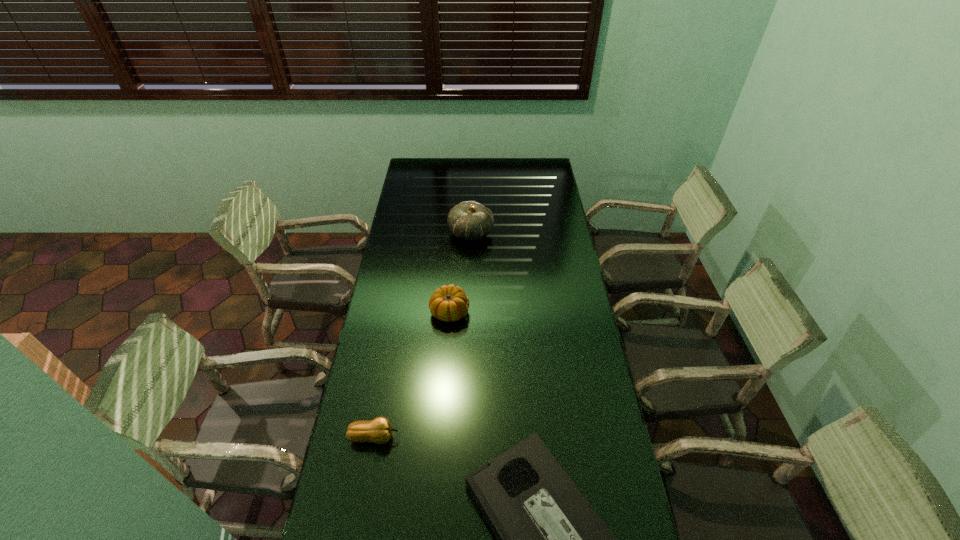
Where is `free space at the far edge of the desktop`? free space at the far edge of the desktop is located at coordinates (456, 176).

In the image, there is a desktop. Identify the location of vacant space at the left edge. (379, 411).

At what (x,y) coordinates should I click in order to perform the action: click on vacant area at the right edge of the desktop. Please return your answer as a coordinate pair (x, y). The image size is (960, 540). Looking at the image, I should click on (556, 226).

At what (x,y) coordinates should I click in order to perform the action: click on empty space between the tallest gourd and the third tallest object. Please return your answer as a coordinate pair (x, y). The image size is (960, 540). Looking at the image, I should click on (422, 335).

I want to click on free space between the farthest object and the third shortest object, so click(461, 272).

The image size is (960, 540). Identify the location of free spot between the second tallest gourd and the farthest gourd. (461, 272).

Where is `the closest object relative to the third shortest object`? This screenshot has height=540, width=960. the closest object relative to the third shortest object is located at coordinates (469, 220).

Choose which object is the second nearest neighbor to the leftmost object. Please provide its 2D coordinates. Your answer should be formatted as a tuple, i.e. [(x, y)], where the tuple contains the x and y coordinates of a point satisfying the conditions above.

[(448, 303)]

In order to click on the second closest gourd to the shortest object in this screenshot , I will do `click(448, 303)`.

Locate which gourd is the third closest to the videotape. Please provide its 2D coordinates. Your answer should be formatted as a tuple, i.e. [(x, y)], where the tuple contains the x and y coordinates of a point satisfying the conditions above.

[(469, 220)]